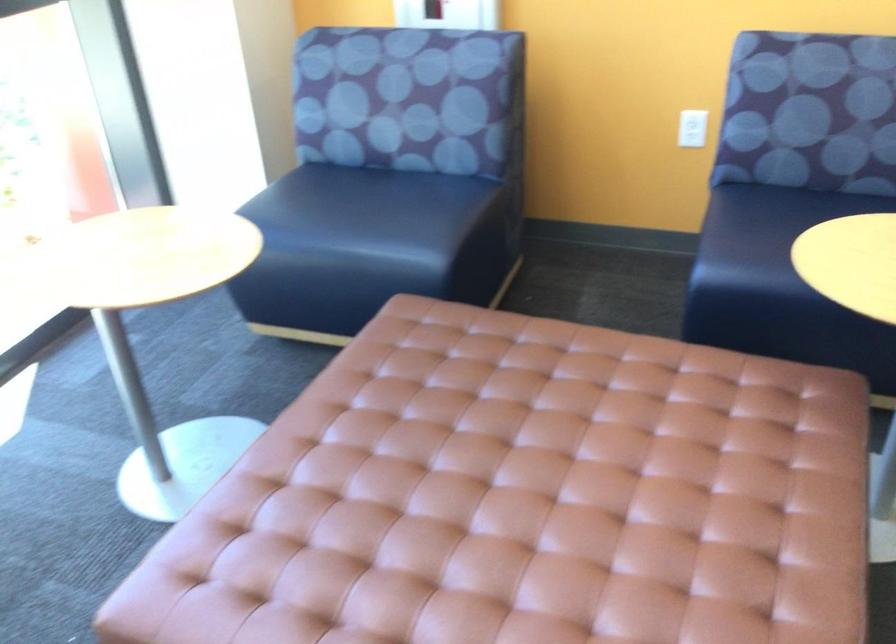
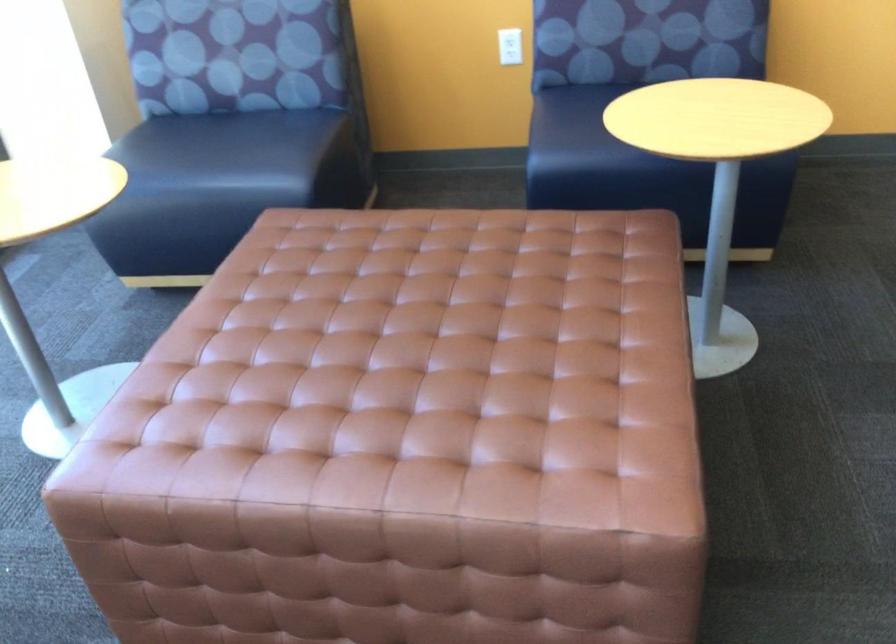
The point at (341, 207) is marked in the first image. Where is the corresponding point in the second image?

(199, 149)